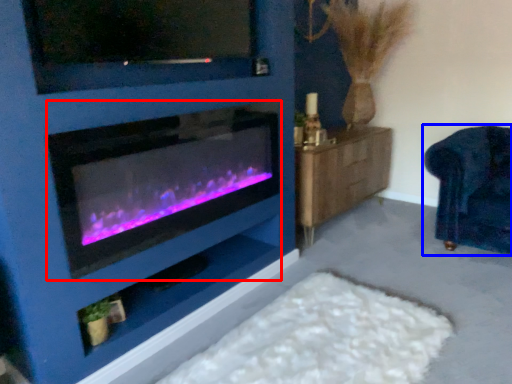
Question: Which object is further to the camera taking this photo, wood burning stove (highlighted by a red box) or furniture (highlighted by a blue box)?

Choices:
 (A) wood burning stove
 (B) furniture

Answer: (B)